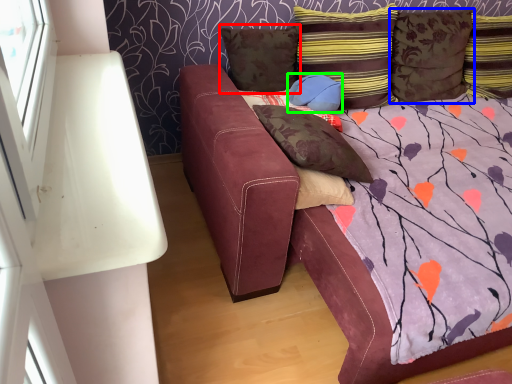
Question: Which object is the closest to the pillow (highlighted by a red box)? Choose among these: pillow (highlighted by a blue box) or pillow (highlighted by a green box).

Choices:
 (A) pillow
 (B) pillow

Answer: (B)